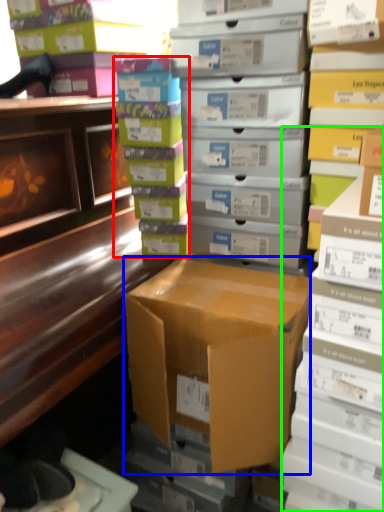
Question: Which object is the farthest from book (highlighted by a red box)? Choose among these: box (highlighted by a blue box) or book (highlighted by a green box).

Choices:
 (A) box
 (B) book

Answer: (B)